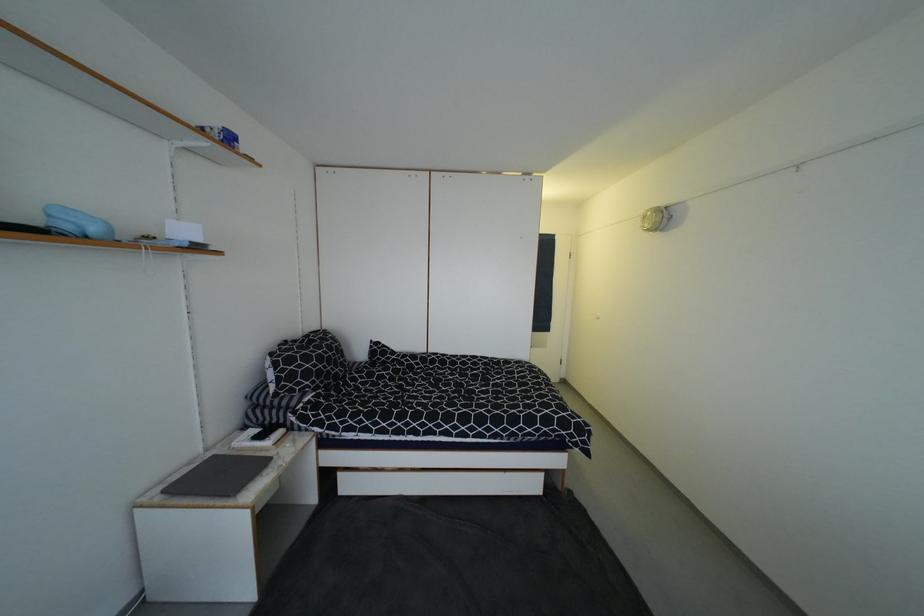
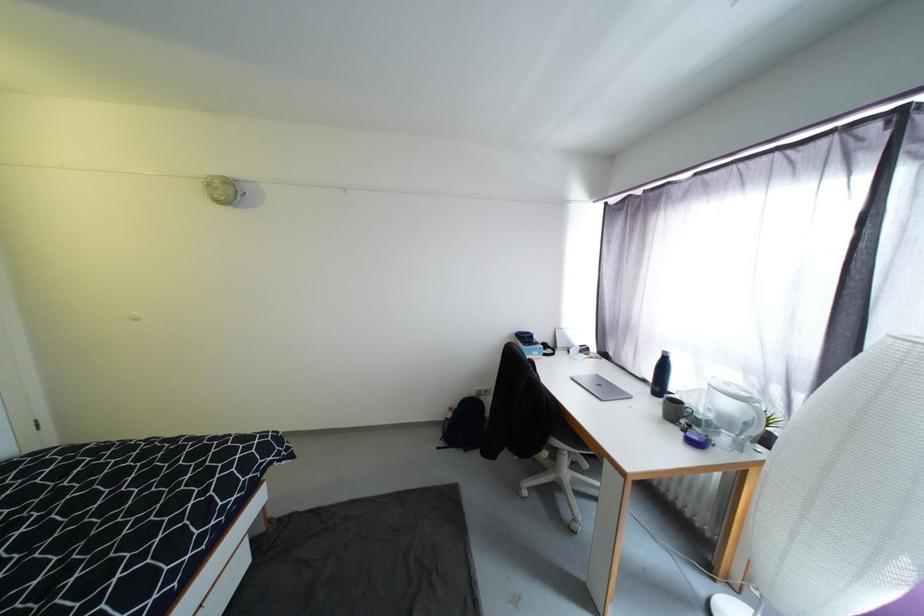
Question: How did the camera likely rotate?

Choices:
 (A) Left
 (B) Right
 (C) Up
 (D) Down

Answer: (B)